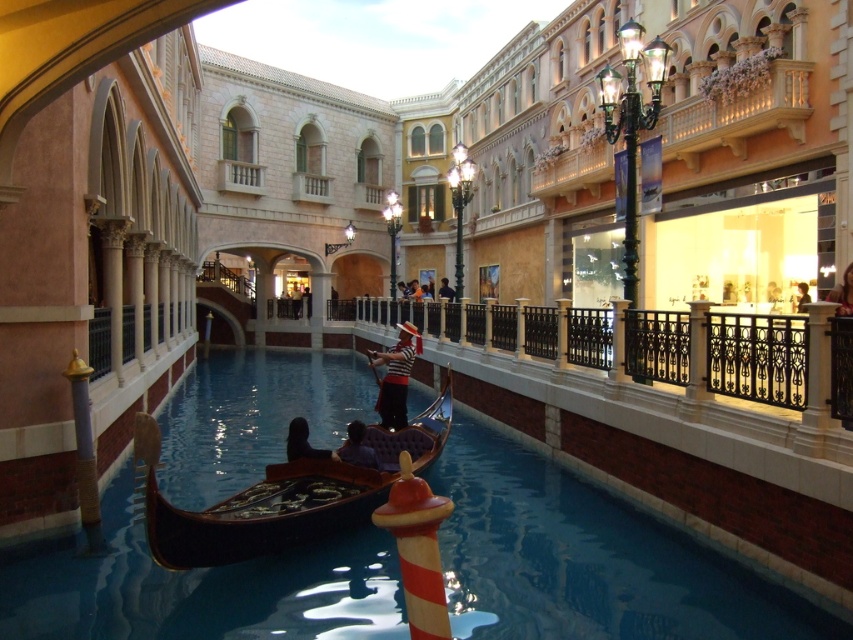
You are a fashion designer observing the indoor canal scene. You notice two garments in the image. The first is a light brown leather jacket at upper right, and the second is a dark blue fabric shirt at center. Which garment has a smaller width?

The light brown leather jacket at upper right has a smaller width than the dark blue fabric shirt at center.

You are standing on the gondola in the canal scene. You want to reach the black wrought iron railing at center to touch it. Can you estimate how far you need to move forward from your current position on the gondola?

The black wrought iron railing at center is located at point (x=758, y=356), so you need to move forward approximately 0.559 meters from your current position on the gondola to reach it.

You are a photographer planning to capture the entire gondola and the water surface in one frame. Given the scene described, can you fit both the black polished water at center and the smooth black gondola at center in your shot if the camera has a standard 50mm lens? Explain why based on their sizes.

The black polished water at center is wider than the smooth black gondola at center. Since the water is wider, using a standard 50mm lens should allow capturing both elements within the frame as the water provides the broader dimension.